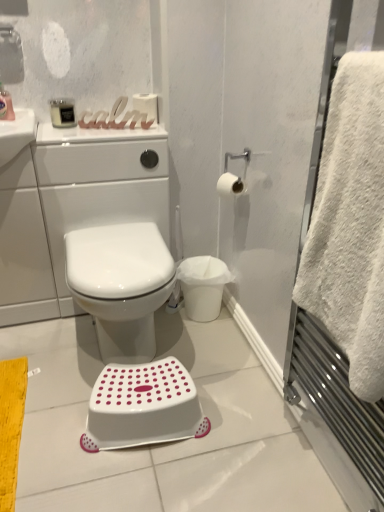
Question: Does white matte toilet paper at upper center, positioned as the 2th toilet paper in bottom-to-top order, appear on the right side of white matte toilet paper at upper right, the 2th toilet paper positioned from the left?

Choices:
 (A) no
 (B) yes

Answer: (A)

Question: Does white matte toilet paper at upper center, positioned as the 2th toilet paper in bottom-to-top order, have a larger size compared to white matte toilet paper at upper right, the 2th toilet paper positioned from the left?

Choices:
 (A) yes
 (B) no

Answer: (A)

Question: Is white matte toilet paper at upper center, positioned as the 2th toilet paper in bottom-to-top order, positioned in front of white matte toilet paper at upper right, the first toilet paper when ordered from right to left?

Choices:
 (A) no
 (B) yes

Answer: (A)

Question: Is white matte toilet paper at upper center, arranged as the second toilet paper when viewed from the right, facing towards white matte toilet paper at upper right, arranged as the 2th toilet paper when viewed from the top?

Choices:
 (A) no
 (B) yes

Answer: (A)

Question: Is white matte toilet paper at upper right, which appears as the second toilet paper when viewed from the back, surrounded by white matte toilet paper at upper center, which appears as the first toilet paper when viewed from the back?

Choices:
 (A) yes
 (B) no

Answer: (B)

Question: Is white matte toilet paper at upper center, which appears as the first toilet paper when viewed from the back, facing away from white matte toilet paper at upper right, arranged as the 2th toilet paper when viewed from the top?

Choices:
 (A) no
 (B) yes

Answer: (A)

Question: Is white glossy bidet at center at the back of matte black soap dispenser at upper left, which is the first toiletry from left to right?

Choices:
 (A) yes
 (B) no

Answer: (B)

Question: Are matte black soap dispenser at upper left, which is the first toiletry from left to right, and white glossy bidet at center located far from each other?

Choices:
 (A) yes
 (B) no

Answer: (B)

Question: Is white glossy bidet at center a part of matte black soap dispenser at upper left, which is the first toiletry from left to right?

Choices:
 (A) no
 (B) yes

Answer: (A)

Question: Does matte black soap dispenser at upper left, the second toiletry when ordered from right to left, have a greater width compared to white glossy bidet at center?

Choices:
 (A) yes
 (B) no

Answer: (B)

Question: Is the depth of matte black soap dispenser at upper left, the second toiletry when ordered from right to left, greater than that of white glossy bidet at center?

Choices:
 (A) no
 (B) yes

Answer: (B)

Question: Can you confirm if matte black soap dispenser at upper left, the second toiletry when ordered from right to left, is smaller than white glossy bidet at center?

Choices:
 (A) no
 (B) yes

Answer: (B)

Question: From the image's perspective, is white matte toilet paper at upper right, the first toilet paper when ordered from right to left, located beneath white glossy toilet at center?

Choices:
 (A) no
 (B) yes

Answer: (A)